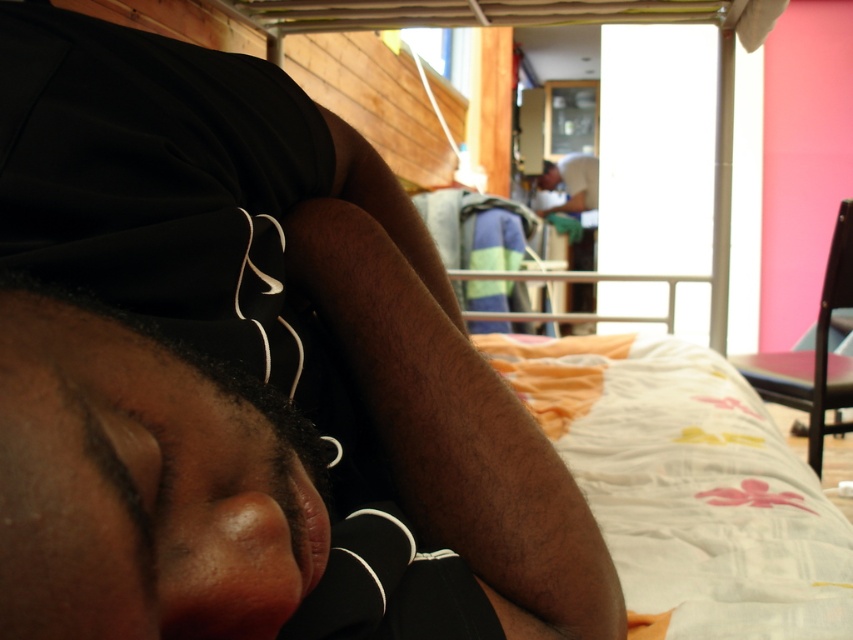
Question: Is black fabric at center smaller than white cotton shirt at center?

Choices:
 (A) yes
 (B) no

Answer: (A)

Question: Among these objects, which one is nearest to the camera?

Choices:
 (A) white cotton shirt at center
 (B) black matte head at center
 (C) black fabric at center

Answer: (C)

Question: Can you confirm if black fabric at center is positioned to the left of white cotton shirt at center?

Choices:
 (A) yes
 (B) no

Answer: (A)

Question: Is black fabric at center closer to the viewer compared to white cotton shirt at center?

Choices:
 (A) no
 (B) yes

Answer: (B)

Question: Estimate the real-world distances between objects in this image. Which object is closer to the black matte head at center?

Choices:
 (A) black fabric at center
 (B) white cotton shirt at center

Answer: (A)

Question: Which point is farther to the camera?

Choices:
 (A) white cotton shirt at center
 (B) black fabric at center
 (C) black matte head at center

Answer: (A)